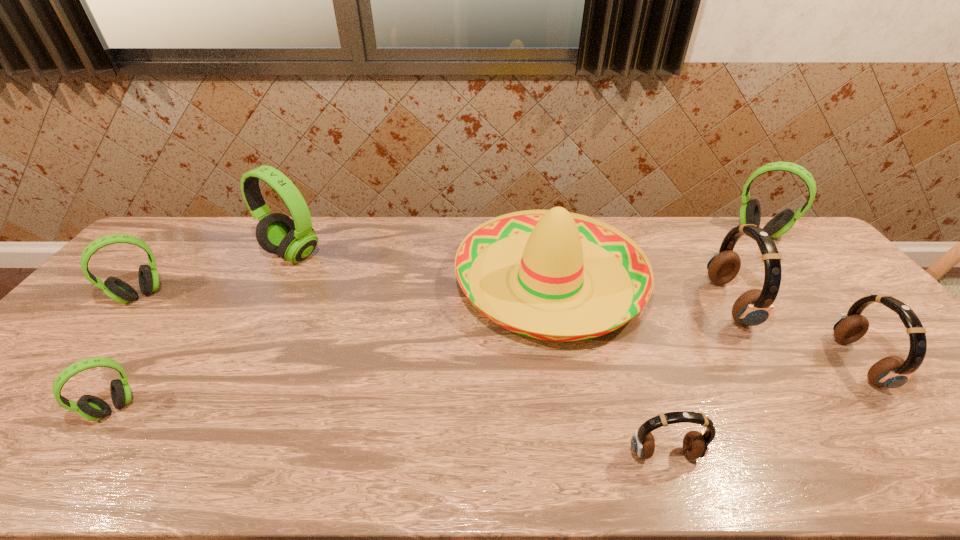
I want to click on the seventh object from right to left, so click(90, 407).

You are a GUI agent. You are given a task and a screenshot of the screen. Output one action in this format:
    pyautogui.click(x=<x>, y=<y>)
    Task: Click on the fourth headset from right to left
    The height and width of the screenshot is (540, 960).
    Given the screenshot: What is the action you would take?
    pyautogui.click(x=696, y=444)

Where is `the nearest object`? the nearest object is located at coordinates (696, 444).

You are a GUI agent. You are given a task and a screenshot of the screen. Output one action in this format:
    pyautogui.click(x=<x>, y=<y>)
    Task: Click on the vacant area situated on the right of the second green headset from right to left
    
    Given the screenshot: What is the action you would take?
    pyautogui.click(x=379, y=254)

Where is `vacant area located on the front of the sombrero`? vacant area located on the front of the sombrero is located at coordinates (585, 474).

Find the location of `vacant region located on the front of the second biggest green headset`. vacant region located on the front of the second biggest green headset is located at coordinates (799, 280).

Find the location of a particular element. This screenshot has height=540, width=960. free space located 0.060m on the ear cup of the second brown headset from right to left is located at coordinates (694, 303).

Where is `free spot located 0.210m on the ear cup of the second brown headset from right to left`? free spot located 0.210m on the ear cup of the second brown headset from right to left is located at coordinates 642,303.

This screenshot has height=540, width=960. In order to click on vacant area situated on the ear cup of the second brown headset from right to left in this screenshot , I will do [x=684, y=303].

Identify the location of vacant space situated 0.160m on the right of the second nearest green headset. The width and height of the screenshot is (960, 540). (219, 295).